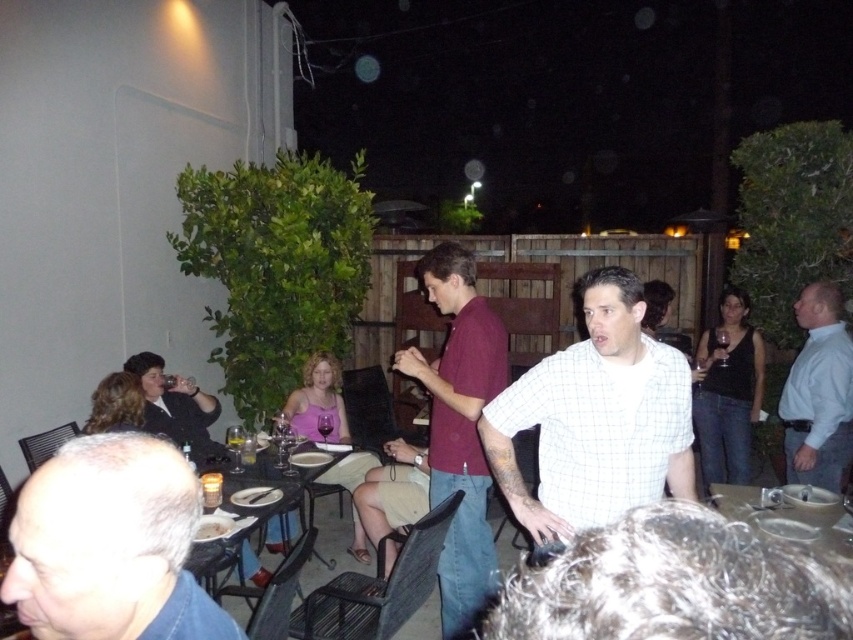
Question: Considering the relative positions of white shirt at right and black glass table at center in the image provided, where is white shirt at right located with respect to black glass table at center?

Choices:
 (A) above
 (B) below

Answer: (A)

Question: Which object is positioned farthest from the black glass table at center?

Choices:
 (A) white shirt at right
 (B) white checkered shirt at center
 (C) maroon shirt at center

Answer: (A)

Question: Which of the following is the farthest from the observer?

Choices:
 (A) (235, 547)
 (B) (183, 532)
 (C) (807, 326)

Answer: (C)

Question: Does white shirt at right appear on the left side of matte black shirt at center?

Choices:
 (A) no
 (B) yes

Answer: (A)

Question: Observing the image, what is the correct spatial positioning of gray hair at lower left in reference to maroon shirt at center?

Choices:
 (A) below
 (B) above

Answer: (B)

Question: Which object appears farthest from the camera in this image?

Choices:
 (A) black glass table at center
 (B) maroon shirt at center
 (C) white shirt at right
 (D) matte black shirt at center

Answer: (C)